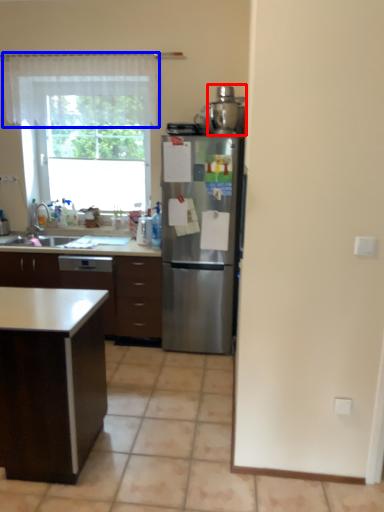
Question: Which object appears farthest to the camera in this image, appliance (highlighted by a red box) or curtain (highlighted by a blue box)?

Choices:
 (A) appliance
 (B) curtain

Answer: (B)